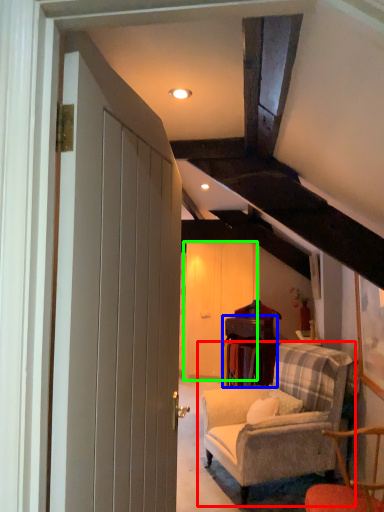
Question: Which object is positioned farthest from studio couch (highlighted by a red box)? Select from table (highlighted by a blue box) and barn door (highlighted by a green box).

Choices:
 (A) table
 (B) barn door

Answer: (B)